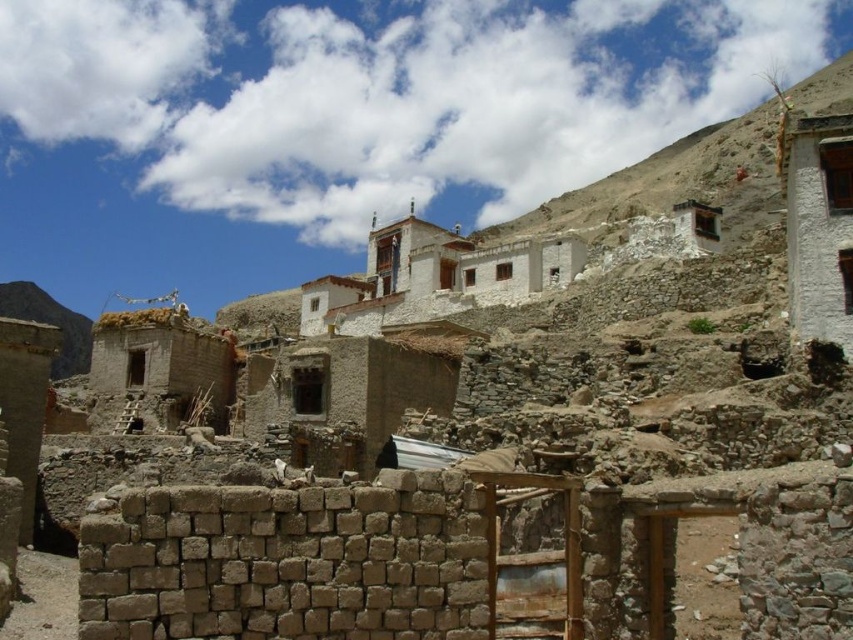
Does white stucco building at upper right appear on the right side of brown stone wall at lower left?

Correct, you'll find white stucco building at upper right to the right of brown stone wall at lower left.

What are the coordinates of `white stucco building at upper right` in the screenshot? It's located at (660, 180).

Locate an element on the screen. This screenshot has width=853, height=640. white stucco building at upper right is located at coordinates (660, 180).